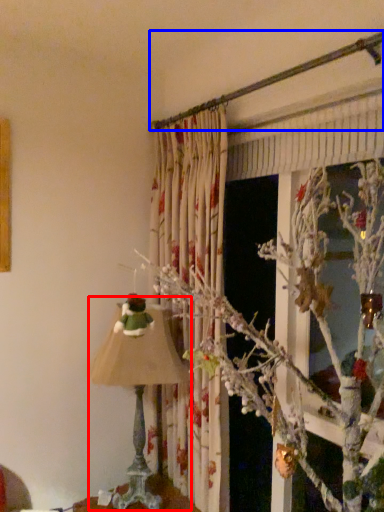
Question: Which point is closer to the camera, lamp (highlighted by a red box) or branch (highlighted by a blue box)?

Choices:
 (A) lamp
 (B) branch

Answer: (B)